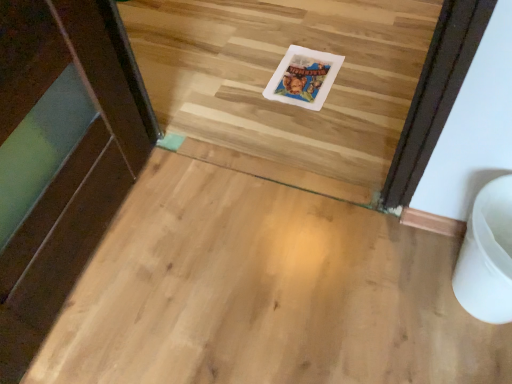
Image resolution: width=512 pixels, height=384 pixels. I want to click on free location above white plastic postcard at center (from a real-world perspective), so click(307, 72).